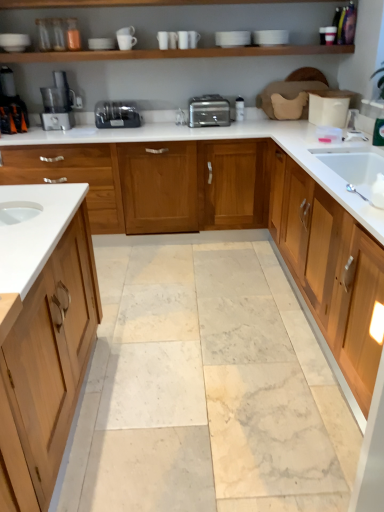
Question: Can you confirm if satin silver toaster at center is smaller than satin silver food processor at left?

Choices:
 (A) no
 (B) yes

Answer: (B)

Question: From the image's perspective, is satin silver toaster at center below satin silver food processor at left?

Choices:
 (A) yes
 (B) no

Answer: (A)

Question: Is satin silver toaster at center further to the viewer compared to satin silver food processor at left?

Choices:
 (A) yes
 (B) no

Answer: (A)

Question: Is satin silver toaster at center taller than satin silver food processor at left?

Choices:
 (A) no
 (B) yes

Answer: (A)

Question: Considering the relative sizes of satin silver toaster at center and satin silver food processor at left in the image provided, is satin silver toaster at center bigger than satin silver food processor at left?

Choices:
 (A) no
 (B) yes

Answer: (A)

Question: Is satin silver toaster at center in front of satin silver food processor at left?

Choices:
 (A) yes
 (B) no

Answer: (B)

Question: Does satin silver food processor at left have a lesser width compared to satin silver toaster at center?

Choices:
 (A) no
 (B) yes

Answer: (A)

Question: Is the position of satin silver food processor at left less distant than that of satin silver toaster at center?

Choices:
 (A) yes
 (B) no

Answer: (A)

Question: From the image's perspective, does satin silver food processor at left appear higher than satin silver toaster at center?

Choices:
 (A) yes
 (B) no

Answer: (A)

Question: Is satin silver food processor at left facing towards satin silver toaster at center?

Choices:
 (A) no
 (B) yes

Answer: (A)

Question: Is satin silver food processor at left not near satin silver toaster at center?

Choices:
 (A) no
 (B) yes

Answer: (A)

Question: Can you confirm if satin silver food processor at left is positioned to the right of satin silver toaster at center?

Choices:
 (A) yes
 (B) no

Answer: (B)

Question: Is white glossy countertop at center surrounded by silver metallic toaster at center?

Choices:
 (A) no
 (B) yes

Answer: (A)